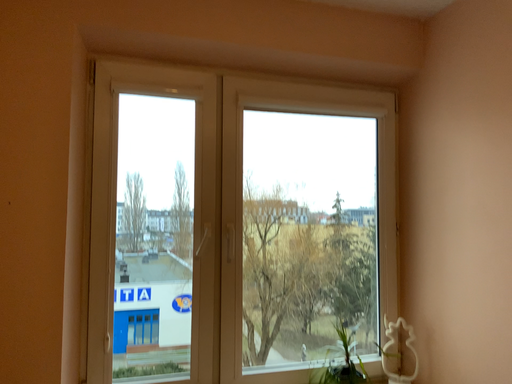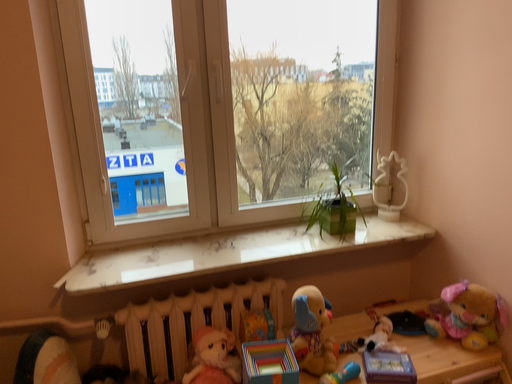
Question: How did the camera likely rotate when shooting the video?

Choices:
 (A) rotated upward
 (B) rotated downward

Answer: (B)